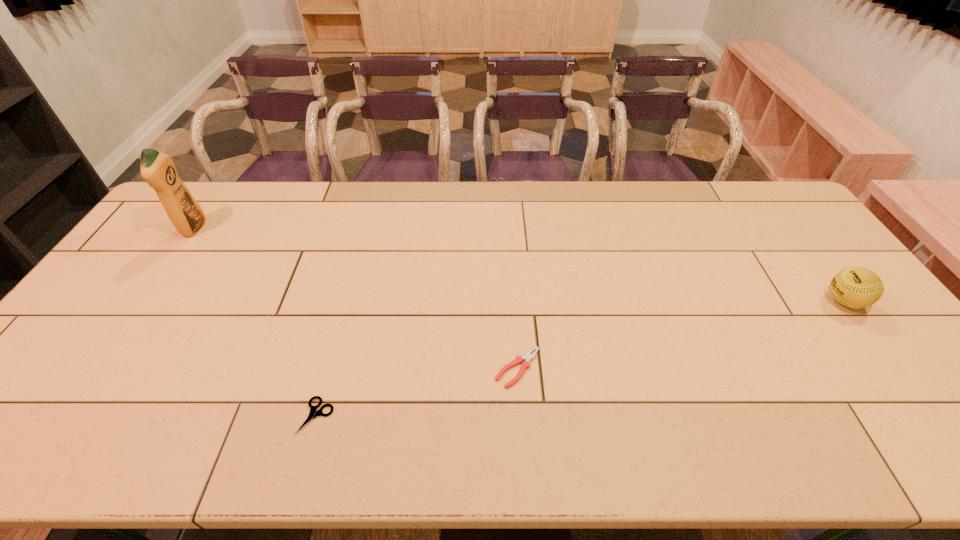
Locate an element on the screen. This screenshot has width=960, height=540. vacant area between the rightmost object and the leftmost object is located at coordinates (519, 265).

Find the location of a particular element. The width and height of the screenshot is (960, 540). vacant space that's between the nearest object and the pliers is located at coordinates (418, 392).

Image resolution: width=960 pixels, height=540 pixels. Find the location of `blank region between the second object from right to left and the second object from left to right`. blank region between the second object from right to left and the second object from left to right is located at coordinates (418, 392).

The image size is (960, 540). I want to click on vacant space that is in between the tallest object and the pliers, so click(356, 298).

In order to click on object that is the second closest to the rightmost object in this screenshot , I will do `click(313, 413)`.

In order to click on object that is the closest one to the third nearest object in this screenshot , I will do `click(527, 357)`.

Find the location of a particular element. free space that satisfies the following two spatial constraints: 1. on the label of the farthest object; 2. on the back side of the shortest object is located at coordinates point(62,416).

Where is `vacant region that satisfies the following two spatial constraints: 1. on the label of the tallest object; 2. on the right side of the third farthest object`? The height and width of the screenshot is (540, 960). vacant region that satisfies the following two spatial constraints: 1. on the label of the tallest object; 2. on the right side of the third farthest object is located at coordinates coord(96,368).

Where is `free location that satisfies the following two spatial constraints: 1. on the label of the second object from left to right; 2. on the right side of the tallest object`? free location that satisfies the following two spatial constraints: 1. on the label of the second object from left to right; 2. on the right side of the tallest object is located at coordinates (62, 416).

Identify the location of free location that satisfies the following two spatial constraints: 1. on the label of the tallest object; 2. on the back side of the pliers. (96, 368).